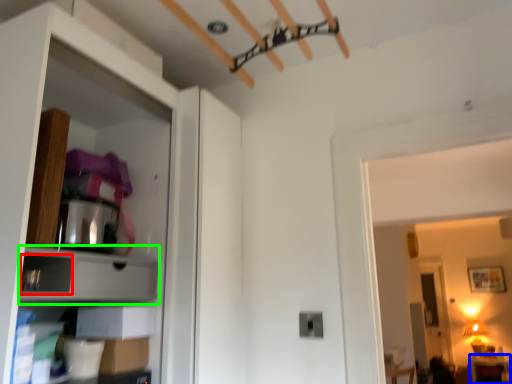
Question: Which is farther away from drawer (highlighted by a red box)? furniture (highlighted by a blue box) or cabinet (highlighted by a green box)?

Choices:
 (A) furniture
 (B) cabinet

Answer: (A)